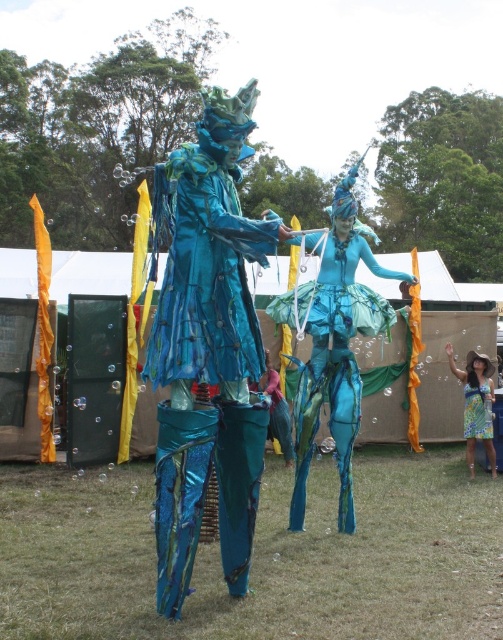
Question: Among these objects, which one is nearest to the camera?

Choices:
 (A) metallic blue costume at center
 (B) shiny metallic costume at center
 (C) teal metallic dress at lower right

Answer: (B)

Question: Which object is closer to the camera taking this photo?

Choices:
 (A) shiny metallic costume at center
 (B) metallic blue costume at center

Answer: (A)

Question: Can you confirm if metallic blue costume at center is bigger than teal metallic dress at lower right?

Choices:
 (A) yes
 (B) no

Answer: (A)

Question: Is shiny metallic costume at center to the right of teal metallic dress at lower right from the viewer's perspective?

Choices:
 (A) no
 (B) yes

Answer: (A)

Question: Which point is closer to the camera taking this photo?

Choices:
 (A) (353, 198)
 (B) (467, 451)

Answer: (A)

Question: Can you confirm if shiny metallic costume at center is thinner than teal metallic dress at lower right?

Choices:
 (A) yes
 (B) no

Answer: (B)